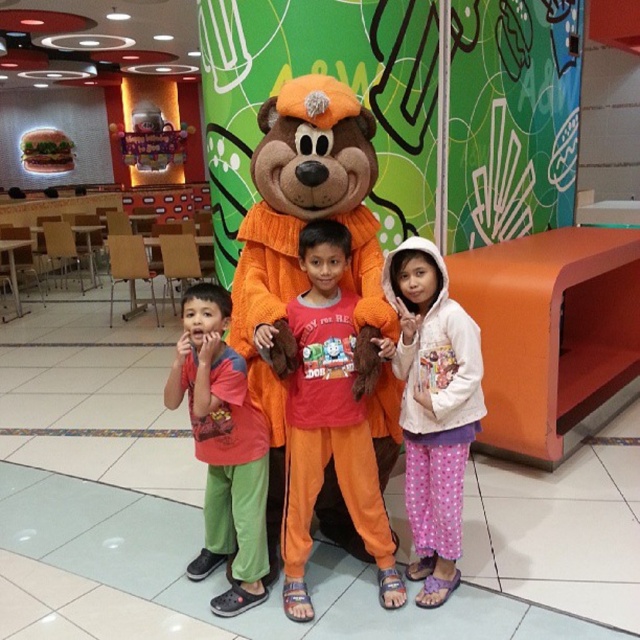
You are standing in the themed restaurant and want to move from point A to point B. Point A is at coordinate point (285, 499) and point B is at coordinate point (205, 301). Which point is closer to you?

Point A at coordinate point (285, 499) is closer to you because it is further to the viewer than point B at coordinate point (205, 301).

You are a child in the scene and want to grab the orange plush toy at center and the white fleece hoodie at center. Which one is closer to you?

The orange plush toy at center is closer to you because it is in front of the white fleece hoodie at center.